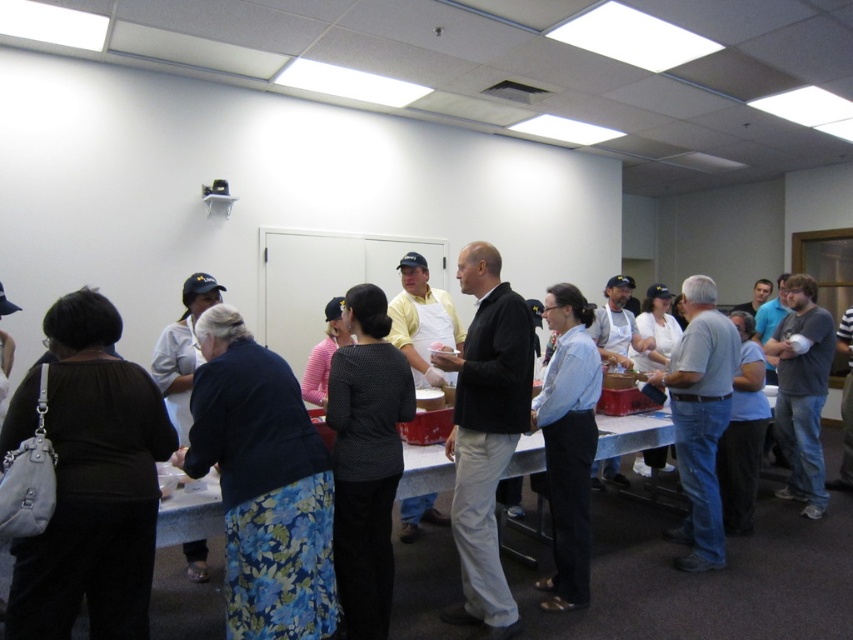
Who is more forward, (343, 413) or (424, 320)?

Positioned in front is point (343, 413).

Is point (363, 476) more distant than point (390, 333)?

No, (363, 476) is in front of (390, 333).

Does point (347, 314) come closer to viewer compared to point (450, 308)?

Yes, it is.

The height and width of the screenshot is (640, 853). Identify the location of black dotted shirt at center. (366, 460).

Which is above, black matte shirt at left or light blue shirt at center?

Positioned higher is black matte shirt at left.

Is point (51, 593) positioned in front of point (564, 371)?

Yes.

Identify the location of black matte shirt at left. (93, 484).

Is blue floral skirt at lower left taller than white matte uniform at left?

Indeed, blue floral skirt at lower left has a greater height compared to white matte uniform at left.

Which is in front, point (229, 424) or point (157, 353)?

Point (229, 424) is more forward.

This screenshot has height=640, width=853. Find the location of `blue floral skirt at lower left`. blue floral skirt at lower left is located at coordinates (263, 484).